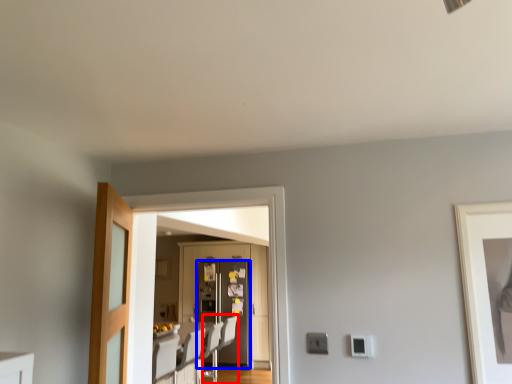
Question: Which object is closer to the camera taking this photo, swivel chair (highlighted by a red box) or refrigerator (highlighted by a blue box)?

Choices:
 (A) swivel chair
 (B) refrigerator

Answer: (A)